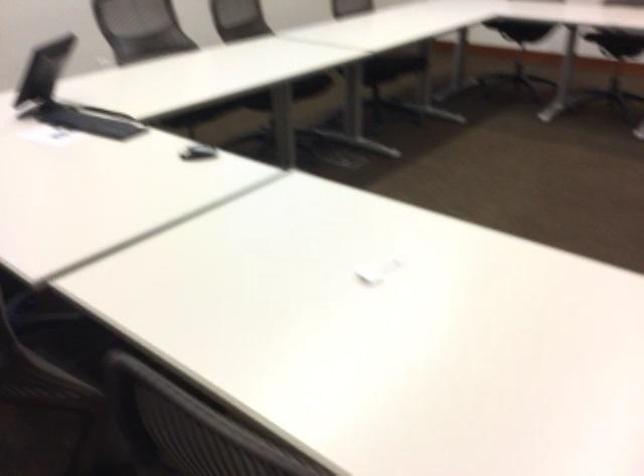
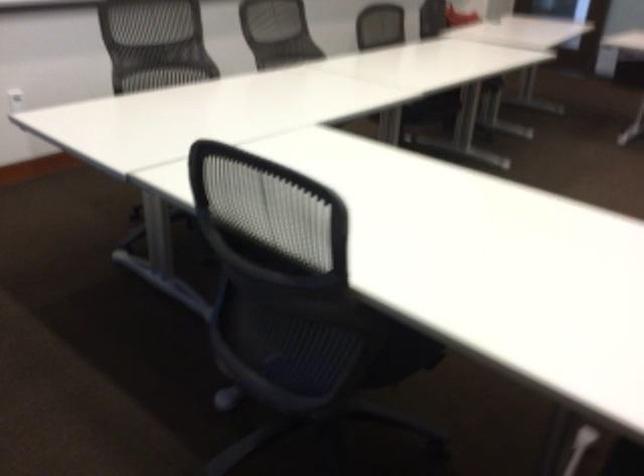
How did the camera likely rotate?

The camera's rotation is toward right-down.